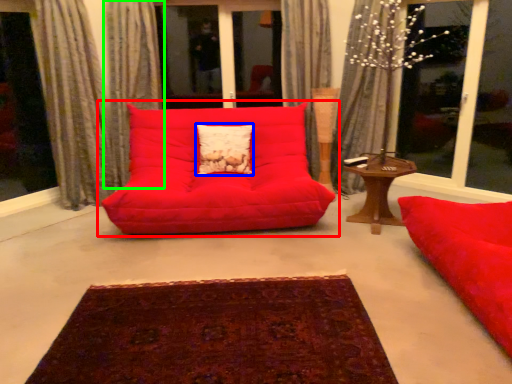
Question: Which object is positioned closest to studio couch (highlighted by a red box)? Select from pillow (highlighted by a blue box) and curtain (highlighted by a green box).

Choices:
 (A) pillow
 (B) curtain

Answer: (A)